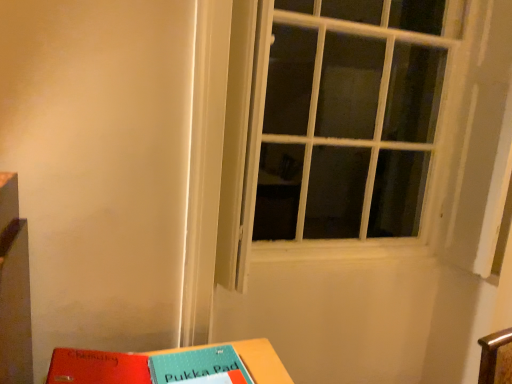
Locate an element on the screen. Image resolution: width=512 pixels, height=384 pixels. red matte paper at lower left is located at coordinates (97, 367).

What do you see at coordinates (345, 115) in the screenshot? This screenshot has height=384, width=512. I see `white textured window at center` at bounding box center [345, 115].

This screenshot has height=384, width=512. I want to click on red matte paper at lower left, so click(x=97, y=367).

Considering the sizes of white textured window at center and matte plastic table at lower center in the image, is white textured window at center taller or shorter than matte plastic table at lower center?

In the image, white textured window at center appears to be taller than matte plastic table at lower center.

Looking at this image, based on their positions, is white textured window at center located to the left or right of matte plastic table at lower center?

white textured window at center is positioned on matte plastic table at lower center's right side.

Is point (368, 10) farther from viewer compared to point (164, 351)?

Yes, point (368, 10) is farther from viewer.

Is white textured window at center inside the boundaries of matte plastic table at lower center, or outside?

white textured window at center lies outside matte plastic table at lower center.

From a real-world perspective, is matte plastic table at lower center above or below white textured window at center?

In terms of real-world spatial position, matte plastic table at lower center is below white textured window at center.

Looking at this image, choose the correct answer: Is matte plastic table at lower center inside white textured window at center or outside it?

matte plastic table at lower center is spatially situated outside white textured window at center.

How different are the orientations of matte plastic table at lower center and white textured window at center in degrees?

The angle between the facing direction of matte plastic table at lower center and the facing direction of white textured window at center is 3.19 degrees.

Between matte plastic table at lower center and white textured window at center, which one appears on the right side from the viewer's perspective?

white textured window at center.

Find the location of `window lying on the right of red matte paper at lower left`. window lying on the right of red matte paper at lower left is located at coordinates (345, 115).

Does point (417, 76) come closer to viewer compared to point (108, 363)?

No.

Would you consider white textured window at center to be distant from red matte paper at lower left?

Yes, white textured window at center and red matte paper at lower left are quite far apart.

Considering the relative sizes of white textured window at center and red matte paper at lower left in the image provided, is white textured window at center smaller than red matte paper at lower left?

Incorrect, white textured window at center is not smaller in size than red matte paper at lower left.

At what (x,y) coordinates should I click in order to perform the action: click on window located above the red matte paper at lower left (from a real-world perspective). Please return your answer as a coordinate pair (x, y). Looking at the image, I should click on (345, 115).

From the image's perspective, relative to white textured window at center, is red matte paper at lower left above or below?

red matte paper at lower left is below white textured window at center.

Is red matte paper at lower left not within white textured window at center?

Yes, red matte paper at lower left is located beyond the bounds of white textured window at center.

From a real-world perspective, which object stands above the other?

white textured window at center.

Considering the relative positions of matte plastic table at lower center and red matte paper at lower left in the image provided, is matte plastic table at lower center to the right of red matte paper at lower left from the viewer's perspective?

Yes, matte plastic table at lower center is to the right of red matte paper at lower left.

At what (x,y) coordinates should I click in order to perform the action: click on table that appears in front of the red matte paper at lower left. Please return your answer as a coordinate pair (x, y). Looking at the image, I should click on (249, 359).

How much distance is there between matte plastic table at lower center and red matte paper at lower left?

matte plastic table at lower center and red matte paper at lower left are 8.14 inches apart from each other.

Is matte plastic table at lower center next to red matte paper at lower left and touching it?

No, matte plastic table at lower center is not next to red matte paper at lower left.

Which of these two, red matte paper at lower left or matte plastic table at lower center, is smaller?

matte plastic table at lower center.

In terms of width, does red matte paper at lower left look wider or thinner when compared to matte plastic table at lower center?

Clearly, red matte paper at lower left has less width compared to matte plastic table at lower center.

Consider the image. Is matte plastic table at lower center inside red matte paper at lower left?

That's incorrect, matte plastic table at lower center is not inside red matte paper at lower left.

How different are the orientations of red matte paper at lower left and matte plastic table at lower center in degrees?

They differ by 3.36 degrees in their facing directions.

This screenshot has height=384, width=512. I want to click on window located above the matte plastic table at lower center (from the image's perspective), so pos(345,115).

You are a GUI agent. You are given a task and a screenshot of the screen. Output one action in this format:
    pyautogui.click(x=<x>, y=<y>)
    Task: Click on the table that is in front of the white textured window at center
    This screenshot has width=512, height=384.
    Given the screenshot: What is the action you would take?
    pyautogui.click(x=249, y=359)

When comparing their distances from white textured window at center, does matte plastic table at lower center or red matte paper at lower left seem closer?

Based on the image, matte plastic table at lower center appears to be nearer to white textured window at center.

Based on their spatial positions, is white textured window at center or matte plastic table at lower center closer to red matte paper at lower left?

matte plastic table at lower center is positioned closer to the anchor red matte paper at lower left.

Estimate the real-world distances between objects in this image. Which object is closer to matte plastic table at lower center, white textured window at center or red matte paper at lower left?

red matte paper at lower left is closer to matte plastic table at lower center.

Which object lies nearer to the anchor point red matte paper at lower left, matte plastic table at lower center or white textured window at center?

matte plastic table at lower center.

Considering their positions, is red matte paper at lower left positioned closer to matte plastic table at lower center than white textured window at center?

red matte paper at lower left lies closer to matte plastic table at lower center than the other object.

Considering their positions, is red matte paper at lower left positioned further to white textured window at center than matte plastic table at lower center?

red matte paper at lower left is further to white textured window at center.

Image resolution: width=512 pixels, height=384 pixels. I want to click on table between red matte paper at lower left and white textured window at center, so click(x=249, y=359).